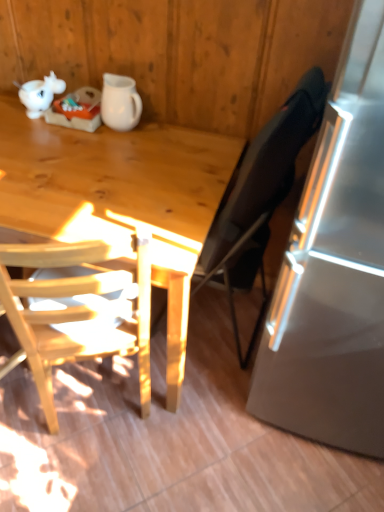
Question: From the image's perspective, is black fabric chair at right, the 2th chair viewed from the left, positioned above or below light wood chair at left, positioned as the 1th chair in left-to-right order?

Choices:
 (A) below
 (B) above

Answer: (B)

Question: Considering the positions of black fabric chair at right, which is counted as the first chair, starting from the right, and light wood chair at left, arranged as the 2th chair when viewed from the right, in the image, is black fabric chair at right, which is counted as the first chair, starting from the right, wider or thinner than light wood chair at left, arranged as the 2th chair when viewed from the right,?

Choices:
 (A) thin
 (B) wide

Answer: (A)

Question: Considering the real-world distances, which object is closest to the black fabric chair at right, which is counted as the first chair, starting from the right?

Choices:
 (A) light wood desk at left
 (B) white matte pitcher at upper center
 (C) light wood chair at left, arranged as the 2th chair when viewed from the right

Answer: (A)

Question: Estimate the real-world distances between objects in this image. Which object is closer to the black fabric chair at right, which is counted as the first chair, starting from the right?

Choices:
 (A) light wood chair at left, arranged as the 2th chair when viewed from the right
 (B) light wood desk at left
 (C) white matte pitcher at upper center

Answer: (B)